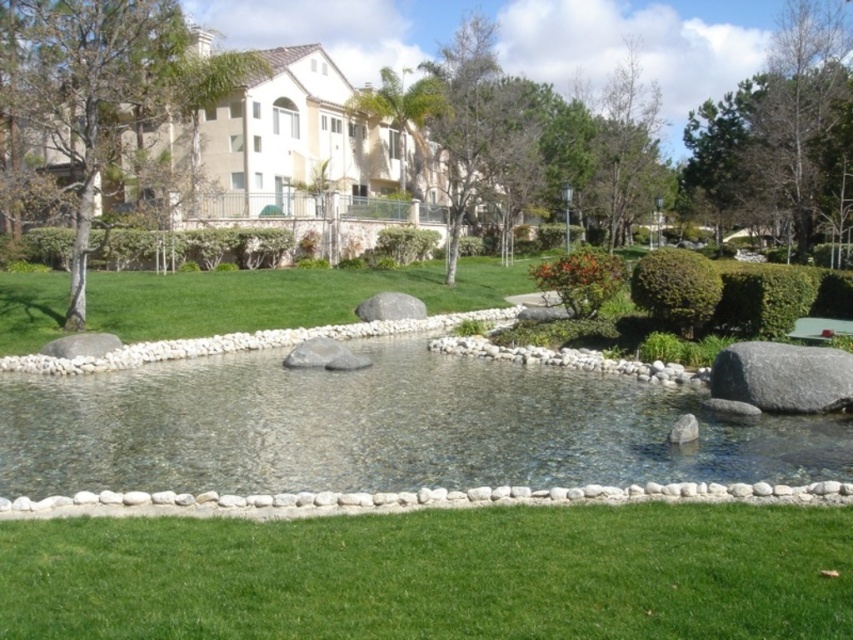
You are standing in the garden and want to walk to the edge of the pond. The green grass at lower center is the path leading there. If you can walk 3 meters per minute, how long will it take you to reach the edge?

The green grass at lower center is 6.66 meters away from the viewer. At a walking speed of 3 meters per minute, it would take approximately 2.22 minutes to reach the edge of the pond.

You are standing in the garden looking at the pond and the surrounding area. There are two points marked in the scene. Which point, point (608, 452) or point (251, 72), is closer to you?

Point (608, 452) is closer to the viewer than point (251, 72).

You are standing in the garden and want to walk from the brown textured tree at upper left to the green grass at lower center. Which direction should you move relative to the tree?

You should move to the right of the brown textured tree at upper left to reach the green grass at lower center since the green grass at lower center is located to the right of the brown textured tree at upper left.